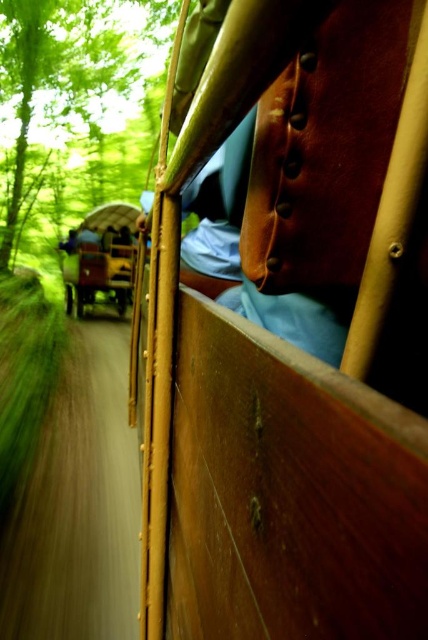
You are a passenger sitting in the vintage train car and looking out the window. You notice the green leafy tree at upper left and the wooden wagon at center. Which object is positioned to the left of the other?

The green leafy tree at upper left is positioned to the left of the wooden wagon at center.

You are a passenger sitting in the vintage train car and looking out the window. You notice a green leafy tree at upper left. Can you estimate its position relative to the window frame?

The green leafy tree at upper left is located at the 2D coordinates of point 0.119 on the x axis and 0.147 on the y axis relative to the window frame.